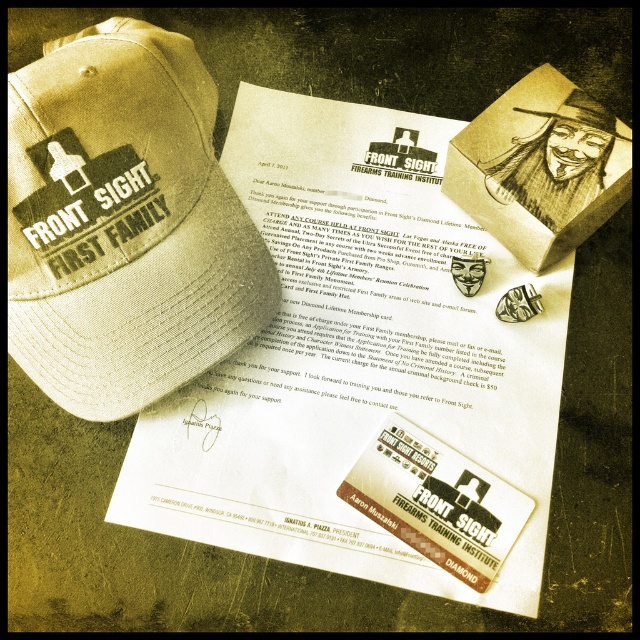
Does white paper at center appear on the left side of matte khaki baseball cap at upper left?

Indeed, white paper at center is positioned on the left side of matte khaki baseball cap at upper left.

Where is `white paper at center`? white paper at center is located at coordinates (364, 364).

Which is behind, point (433, 291) or point (579, 108)?

Positioned behind is point (433, 291).

Find the location of a particular element. The height and width of the screenshot is (640, 640). white paper at center is located at coordinates (364, 364).

Does point (58, 166) come closer to viewer compared to point (586, 113)?

Yes.

Is tan fabric baseball cap at upper left to the left of matte khaki baseball cap at upper left from the viewer's perspective?

Yes, tan fabric baseball cap at upper left is to the left of matte khaki baseball cap at upper left.

This screenshot has height=640, width=640. Describe the element at coordinates (124, 221) in the screenshot. I see `tan fabric baseball cap at upper left` at that location.

At what (x,y) coordinates should I click in order to perform the action: click on tan fabric baseball cap at upper left. Please return your answer as a coordinate pair (x, y). Looking at the image, I should click on (124, 221).

Which is below, white paper at center or tan fabric baseball cap at upper left?

white paper at center

Is point (301, 353) farther from viewer compared to point (19, 189)?

Yes, it is.

I want to click on white paper at center, so click(364, 364).